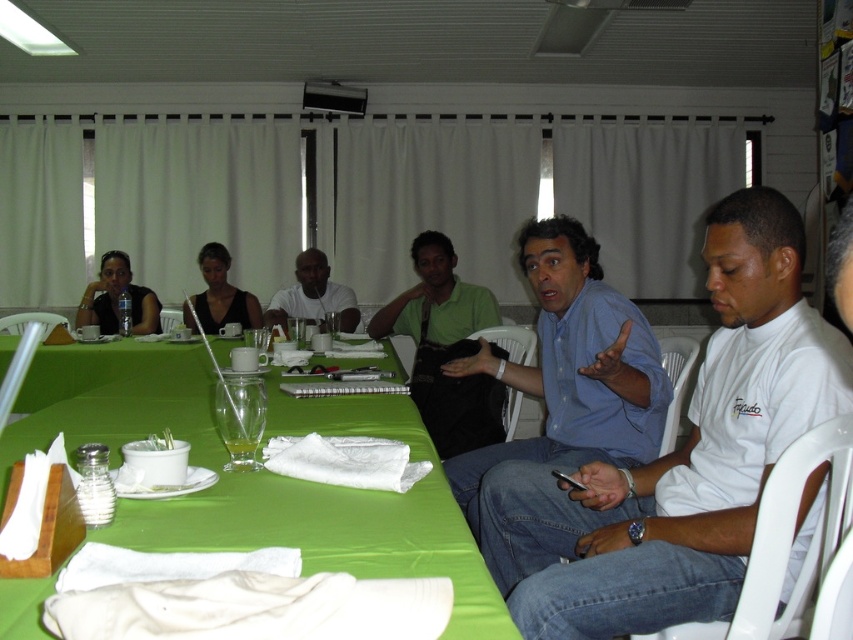
Question: Which point is closer to the camera?

Choices:
 (A) transparent glass at center
 (B) matte white shirt at center
 (C) matte black shirt at upper left
 (D) blue shirt at center

Answer: (D)

Question: Which object is positioned farthest from the matte black top at upper center?

Choices:
 (A) blue shirt at center
 (B) green matte shirt at center
 (C) green fabric table at center

Answer: (A)

Question: Is blue shirt at center behind matte black shirt at upper left?

Choices:
 (A) no
 (B) yes

Answer: (A)

Question: Can you confirm if green matte shirt at center is smaller than transparent glass at center?

Choices:
 (A) no
 (B) yes

Answer: (A)

Question: Is blue shirt at center positioned behind green fabric table at center?

Choices:
 (A) no
 (B) yes

Answer: (B)

Question: Which point is farther to the camera?

Choices:
 (A) (747, 403)
 (B) (351, 323)

Answer: (B)